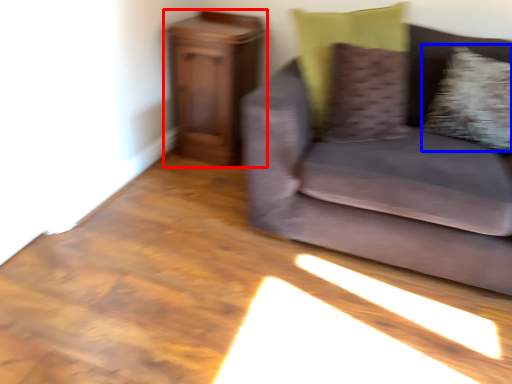
Question: Which of the following is the farthest to the observer, furniture (highlighted by a red box) or pillow (highlighted by a blue box)?

Choices:
 (A) furniture
 (B) pillow

Answer: (A)